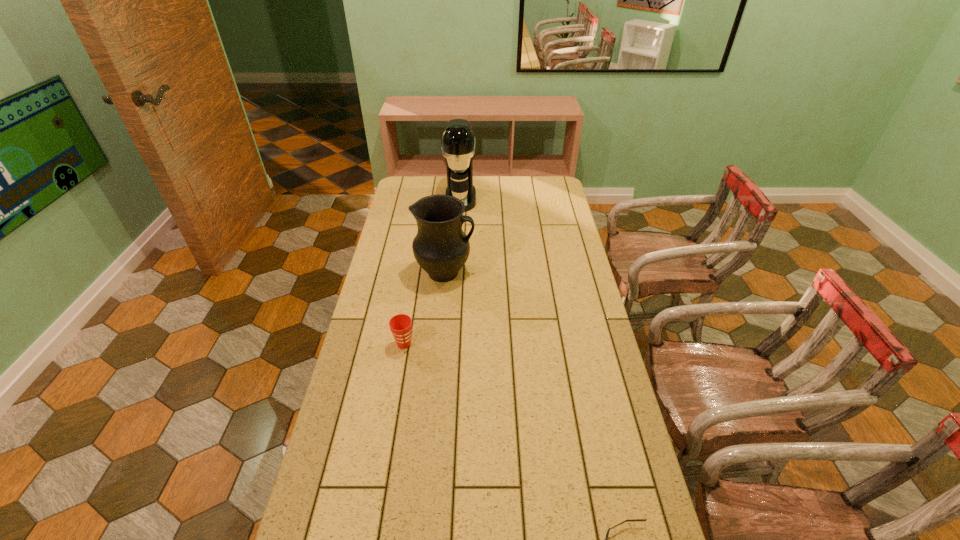
You are a GUI agent. You are given a task and a screenshot of the screen. Output one action in this format:
    pyautogui.click(x=<x>, y=<y>)
    Task: Click on the coffee maker
    Image resolution: width=960 pixels, height=540 pixels.
    Given the screenshot: What is the action you would take?
    pyautogui.click(x=458, y=142)

At what (x,y) coordinates should I click in order to perform the action: click on the farthest object. Please return your answer as a coordinate pair (x, y). This screenshot has width=960, height=540. Looking at the image, I should click on coord(458,142).

The height and width of the screenshot is (540, 960). I want to click on the third shortest object, so click(x=441, y=248).

Where is `pitcher`? The height and width of the screenshot is (540, 960). pitcher is located at coordinates (441, 248).

Locate an element on the screen. the second shortest object is located at coordinates (400, 325).

Identify the location of cup. The height and width of the screenshot is (540, 960). (400, 325).

The height and width of the screenshot is (540, 960). Identify the location of vacant space located 0.180m place cup under the spout of the farthest object. (458, 234).

Where is `vacant space located 0.220m on the handle side of the second tallest object`? vacant space located 0.220m on the handle side of the second tallest object is located at coordinates (530, 273).

The width and height of the screenshot is (960, 540). I want to click on vacant region located 0.050m on the front of the third tallest object, so click(400, 364).

You are a GUI agent. You are given a task and a screenshot of the screen. Output one action in this format:
    pyautogui.click(x=<x>, y=<y>)
    Task: Click on the object that is at the far edge
    
    Given the screenshot: What is the action you would take?
    pyautogui.click(x=458, y=142)